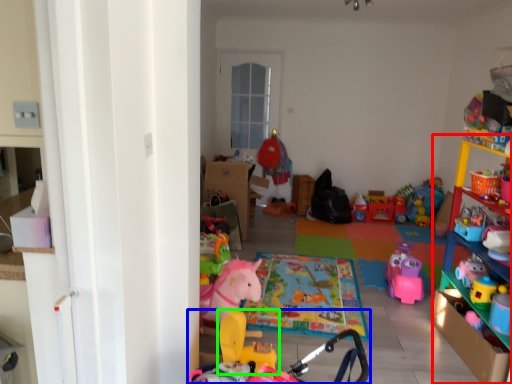
Question: Which object is positioned farthest from shelf (highlighted by a red box)? Select from toy (highlighted by a blue box) and toy (highlighted by a green box).

Choices:
 (A) toy
 (B) toy

Answer: (B)